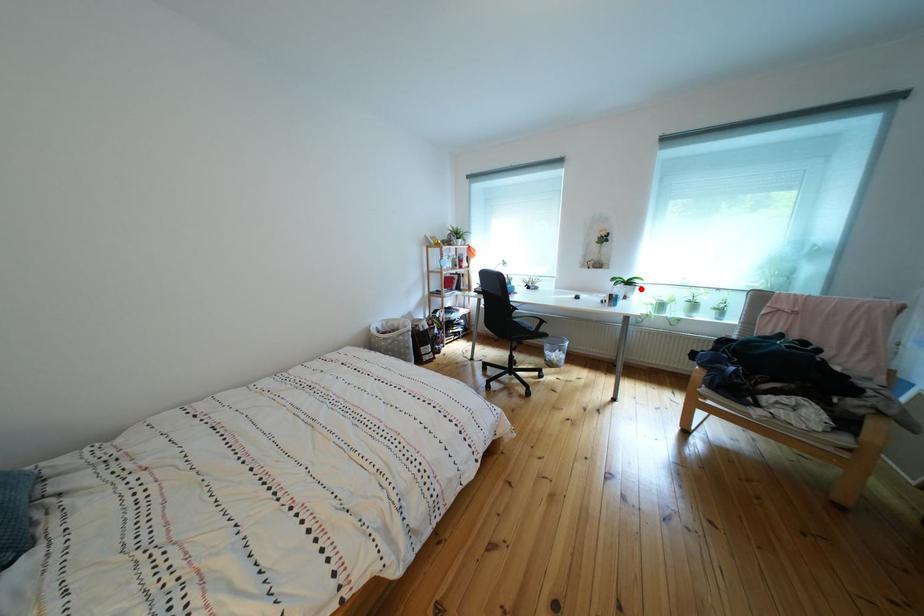
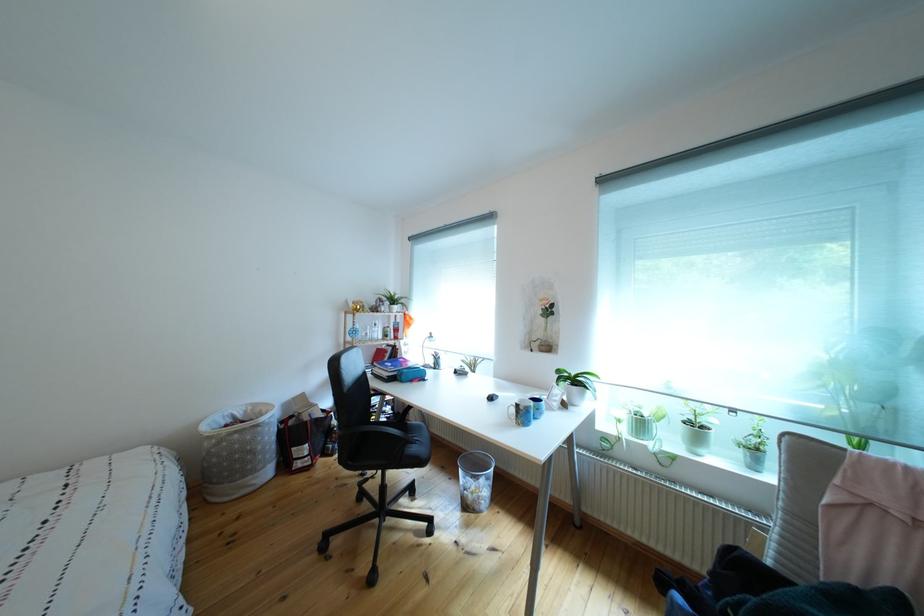
In the second image, find the point that corresponds to the highlighted location in the first image.

(588, 387)